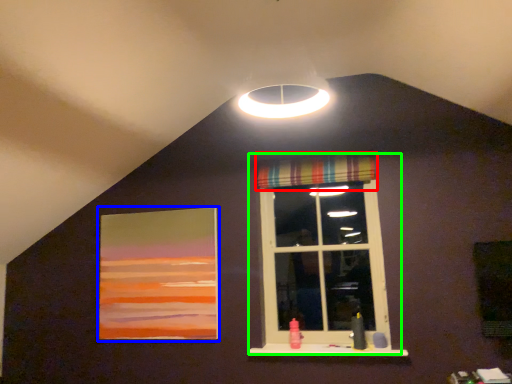
Question: Based on their relative distances, which object is nearer to curtain (highlighted by a red box)? Choose from picture frame (highlighted by a blue box) and window (highlighted by a green box).

Choices:
 (A) picture frame
 (B) window

Answer: (B)